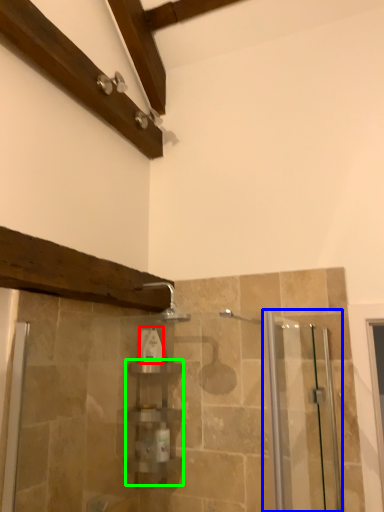
Question: Which object is positioned closest to toiletry (highlighted by a red box)? Select from screen door (highlighted by a blue box) and shelf (highlighted by a green box).

Choices:
 (A) screen door
 (B) shelf

Answer: (B)